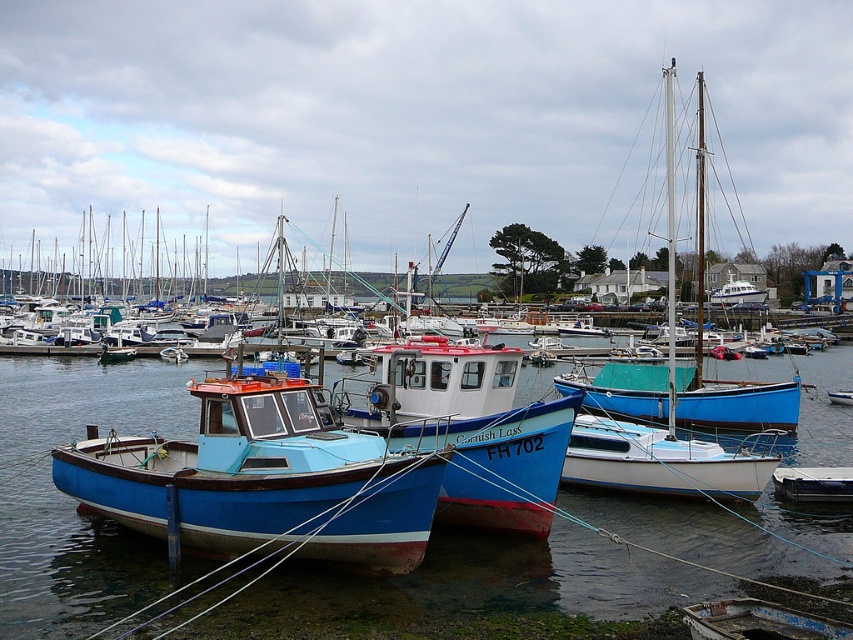
You are a photographer standing at the edge of the marina. You want to capture both the matte blue boat at center and the teal wooden sailboat at center in a single photo. Which boat should you position closer to the front of the frame to include both in your shot?

The matte blue boat at center is located below the teal wooden sailboat at center, so to include both in the photo, you should position the matte blue boat at center closer to the front of the frame.

You are standing on the dock and see the point marked at coordinates (71, 499) in the image. What is located at that point?

The point at coordinates (71, 499) indicates blue matte water at center.

You are standing at the edge of the marina and want to locate two specific points. The first point is at coordinates point (129, 461) and the second is at point (666, 104). Which of these points is nearer to you?

Point (129, 461) is closer to the viewer than point (666, 104).